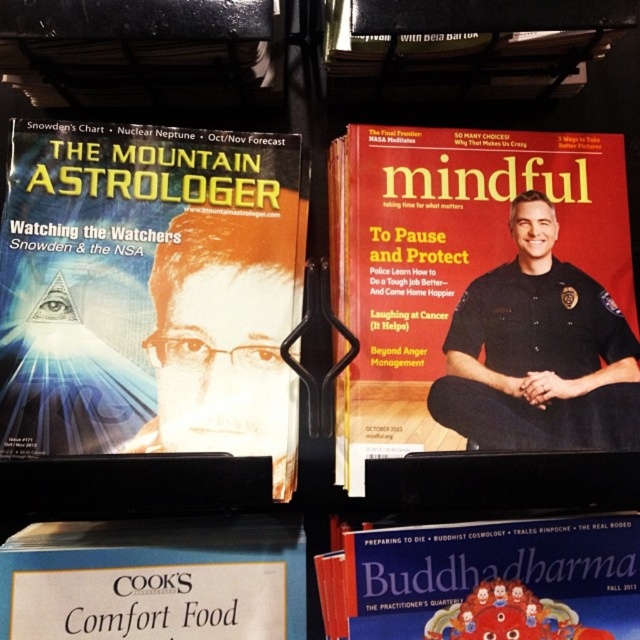
Between point (35, 198) and point (561, 637), which one is positioned behind?

Positioned behind is point (35, 198).

Measure the distance between point (232, 204) and camera.

They are 25.24 inches apart.

The width and height of the screenshot is (640, 640). Identify the location of matte orange magazine at left. (148, 292).

Which is more to the right, matte orange magazine at left or matte black magazine at upper right?

matte black magazine at upper right is more to the right.

Is matte orange magazine at left further to camera compared to matte black magazine at upper right?

No, it is in front of matte black magazine at upper right.

Locate an element on the screen. matte orange magazine at left is located at coordinates (148, 292).

Can you confirm if matte black magazine at upper right is positioned below matte paper buddha dharma at center?

No, matte black magazine at upper right is not below matte paper buddha dharma at center.

Between matte black magazine at upper right and matte paper buddha dharma at center, which one has more height?

Standing taller between the two is matte black magazine at upper right.

Measure the distance between matte black magazine at upper right and camera.

matte black magazine at upper right is 22.26 inches away from camera.

Image resolution: width=640 pixels, height=640 pixels. Identify the location of matte black magazine at upper right. [x=456, y=262].